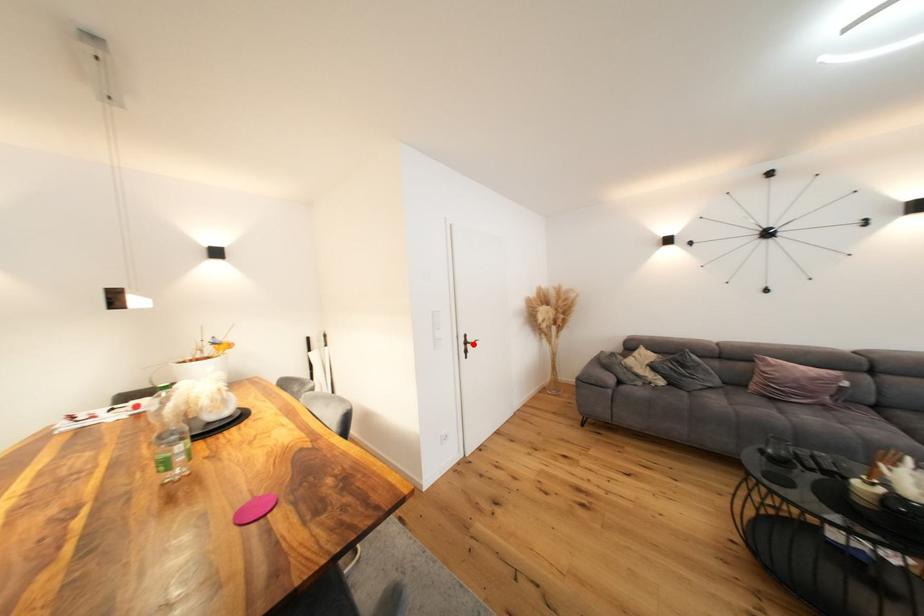
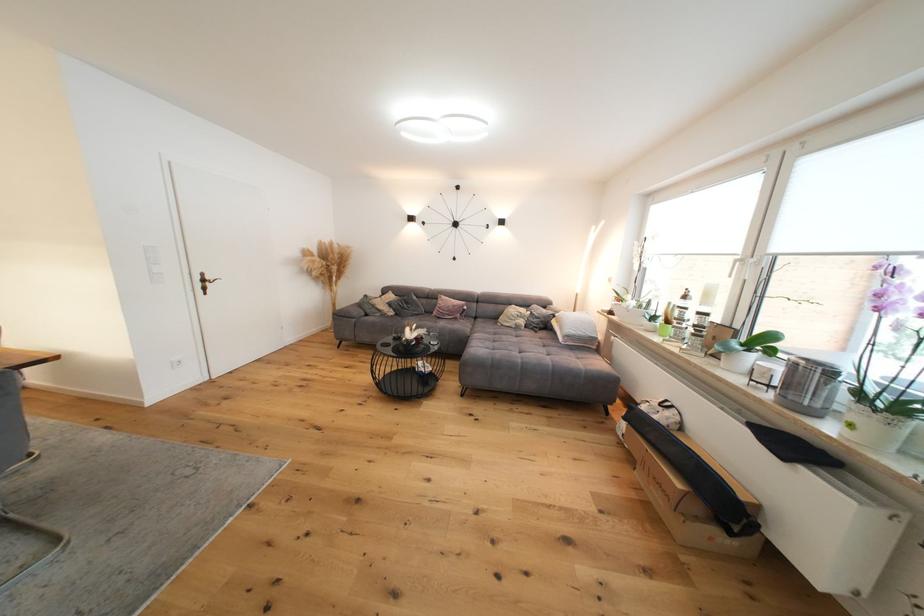
In the second image, find the point that corresponds to the highlighted location in the first image.

(211, 282)